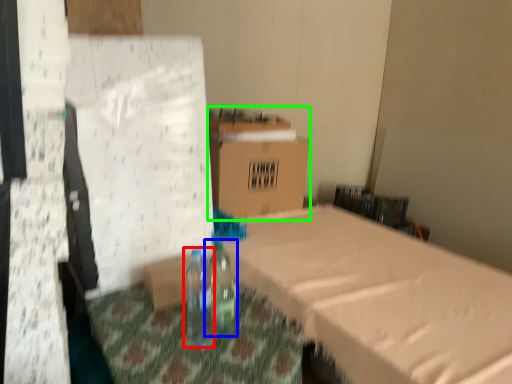
Question: Which is nearer to the bottle (highlighted by a red box)? bottle (highlighted by a blue box) or cardboard box (highlighted by a green box).

Choices:
 (A) bottle
 (B) cardboard box

Answer: (A)